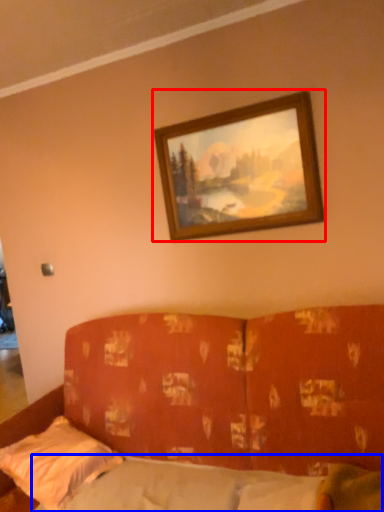
Question: Which object is further to the camera taking this photo, picture frame (highlighted by a red box) or mattress (highlighted by a blue box)?

Choices:
 (A) picture frame
 (B) mattress

Answer: (A)